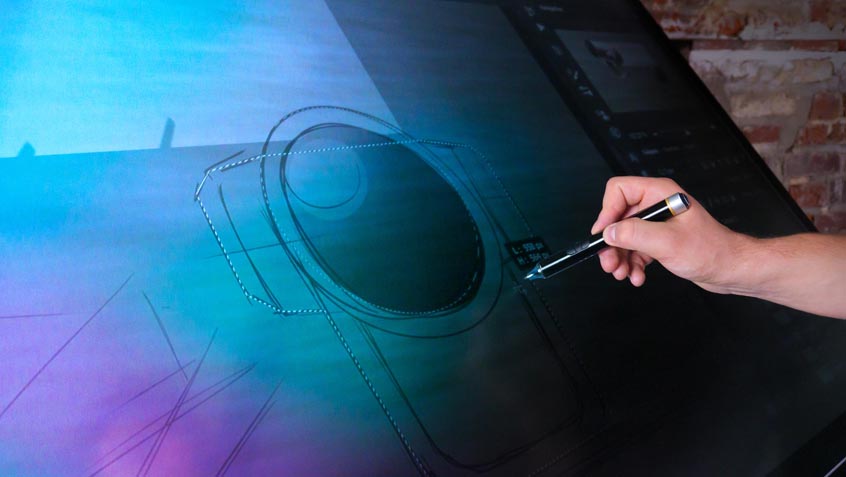
I want to click on wall, so click(x=806, y=125).